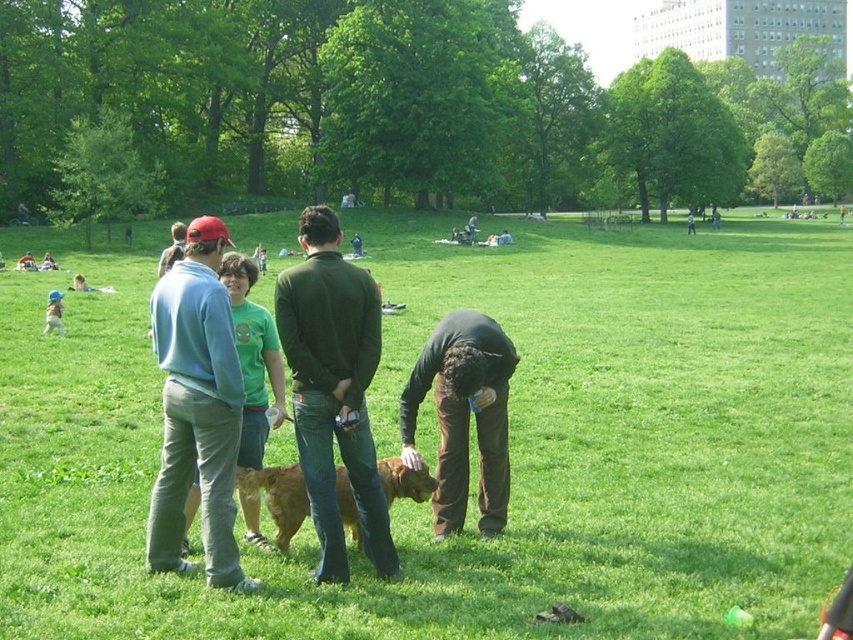
Question: Based on their relative distances, which object is farther from the light blue sweatshirt at left?

Choices:
 (A) green grassy field at center
 (B) golden brown fur at center

Answer: (A)

Question: Which point is farther to the camera?

Choices:
 (A) (433, 392)
 (B) (366, 333)
 (C) (210, 579)

Answer: (A)

Question: Is brown cotton pants at center positioned in front of golden brown fur at center?

Choices:
 (A) no
 (B) yes

Answer: (A)

Question: Can you confirm if green grassy field at center is thinner than brown cotton pants at center?

Choices:
 (A) no
 (B) yes

Answer: (A)

Question: Which of the following is the farthest from the observer?

Choices:
 (A) (180, 289)
 (B) (514, 349)
 (C) (334, 337)

Answer: (B)

Question: Is green matte shirt at center above brown cotton pants at center?

Choices:
 (A) yes
 (B) no

Answer: (A)